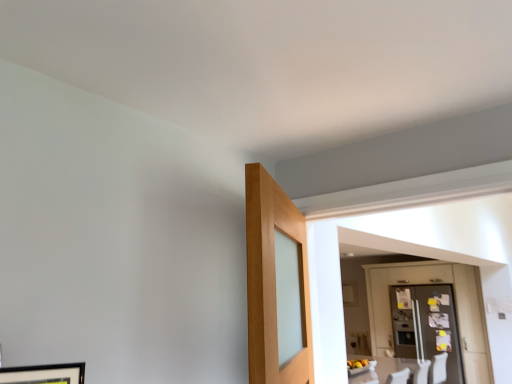
Question: Considering the positions of clear glass refrigerator at right and matte gray refrigerator at right in the image, is clear glass refrigerator at right taller or shorter than matte gray refrigerator at right?

Choices:
 (A) tall
 (B) short

Answer: (B)

Question: Which is correct: clear glass refrigerator at right is inside matte gray refrigerator at right, or outside of it?

Choices:
 (A) inside
 (B) outside

Answer: (A)

Question: Is clear glass refrigerator at right in front of or behind matte gray refrigerator at right in the image?

Choices:
 (A) front
 (B) behind

Answer: (B)

Question: Which is correct: matte gray refrigerator at right is inside clear glass refrigerator at right, or outside of it?

Choices:
 (A) inside
 (B) outside

Answer: (A)

Question: Based on their sizes in the image, would you say matte gray refrigerator at right is bigger or smaller than clear glass refrigerator at right?

Choices:
 (A) small
 (B) big

Answer: (B)

Question: Considering their positions, is matte gray refrigerator at right located in front of or behind clear glass refrigerator at right?

Choices:
 (A) front
 (B) behind

Answer: (A)

Question: From a real-world perspective, is matte gray refrigerator at right physically located above or below clear glass refrigerator at right?

Choices:
 (A) above
 (B) below

Answer: (A)